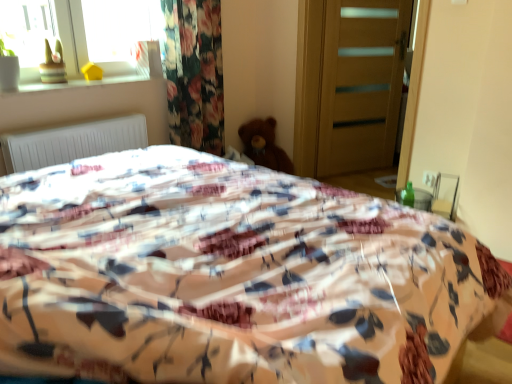
Question: Is matte yellow vase at upper left wider or thinner than floral fabric bed at center?

Choices:
 (A) wide
 (B) thin

Answer: (B)

Question: Is matte yellow vase at upper left inside or outside of floral fabric bed at center?

Choices:
 (A) outside
 (B) inside

Answer: (A)

Question: Which object is the closest to the brown plush teddy bear at center?

Choices:
 (A) matte yellow vase at upper left
 (B) transparent glass window at upper left
 (C) wooden toy at upper left
 (D) white matte radiator at upper left
 (E) floral fabric bed at center

Answer: (B)

Question: Estimate the real-world distances between objects in this image. Which object is closer to the white matte radiator at upper left?

Choices:
 (A) floral fabric bed at center
 (B) wooden door at center
 (C) transparent glass window at upper left
 (D) matte yellow vase at upper left
 (E) wooden toy at upper left

Answer: (E)